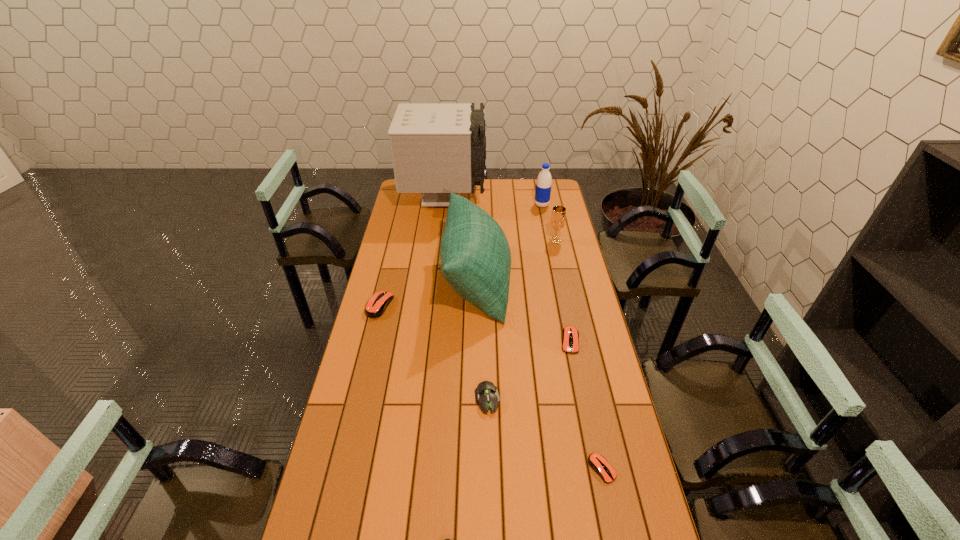
Image resolution: width=960 pixels, height=540 pixels. What are the coordinates of `the bigger gray computer mouse` in the screenshot? It's located at (486, 393).

Identify the location of the right gray computer mouse. Image resolution: width=960 pixels, height=540 pixels. (486, 393).

This screenshot has height=540, width=960. I want to click on the smallest orange computer mouse, so click(x=597, y=462).

At what (x,y) coordinates should I click in order to perform the action: click on the nearest orange computer mouse. Please return your answer as a coordinate pair (x, y). Image resolution: width=960 pixels, height=540 pixels. Looking at the image, I should click on (597, 462).

You are a GUI agent. You are given a task and a screenshot of the screen. Output one action in this format:
    pyautogui.click(x=<x>, y=<y>)
    Task: Click on the free region located 0.180m on the right of the gray fan
    
    Given the screenshot: What is the action you would take?
    pyautogui.click(x=519, y=198)

This screenshot has width=960, height=540. Identify the location of vacant space positioned 0.150m on the front-facing side of the eighth shortest object. (545, 281).

What are the coordinates of `free spot located 0.190m on the front of the water bottle` in the screenshot? It's located at (546, 230).

Where is `free space located 0.240m on the front of the chalice`? free space located 0.240m on the front of the chalice is located at coordinates (564, 278).

The image size is (960, 540). What are the coordinates of `free spot located on the right of the fifth shortest object` in the screenshot? It's located at tap(447, 306).

Identify the location of free space located 0.050m on the back of the second smallest orange computer mouse. The width and height of the screenshot is (960, 540). (565, 319).